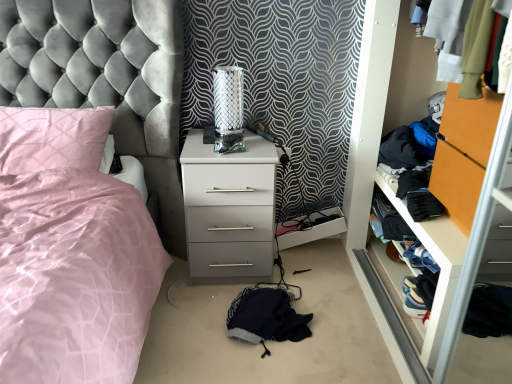
Identify the location of vacant space positioned to the left of fuzzy dark blue blanket at lower center, which is the 3th clothing from top to bottom. (187, 324).